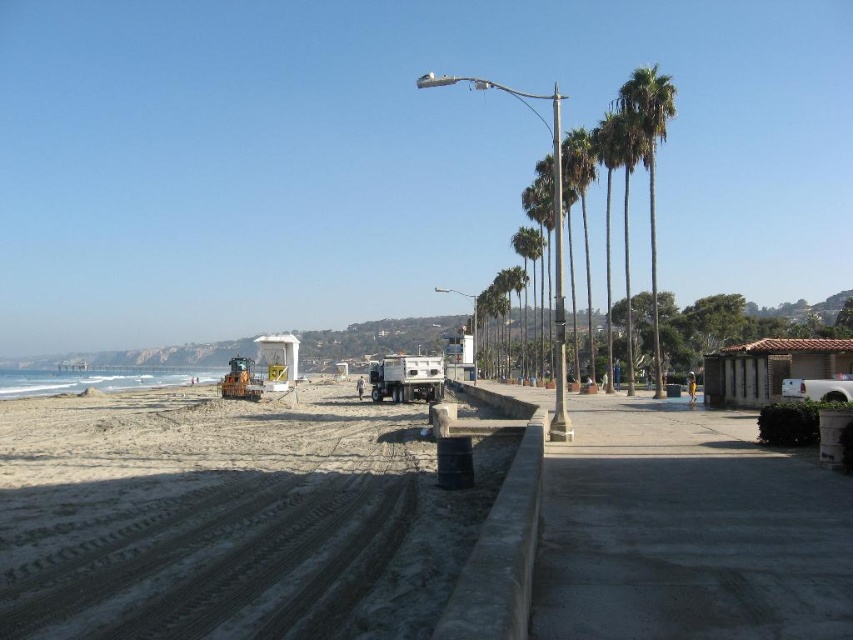
Which is above, white matte camper at center or green leafy palm trees at center?

green leafy palm trees at center

Where is `white matte camper at center`? white matte camper at center is located at coordinates (405, 378).

What do you see at coordinates (405, 378) in the screenshot? This screenshot has width=853, height=640. I see `white matte camper at center` at bounding box center [405, 378].

Image resolution: width=853 pixels, height=640 pixels. Find the location of `white matte camper at center`. white matte camper at center is located at coordinates (405, 378).

Is point (653, 131) positioned behind point (421, 371)?

No.

Who is positioned more to the right, green leafy palm trees at upper right or white matte camper at center?

green leafy palm trees at upper right is more to the right.

Which is behind, point (635, 106) or point (398, 384)?

The point (398, 384) is behind.

Where is `green leafy palm trees at upper right`? The height and width of the screenshot is (640, 853). green leafy palm trees at upper right is located at coordinates click(648, 164).

Does green leafy palm trees at right have a smaller size compared to green leafy palm tree at center-right?

Actually, green leafy palm trees at right might be larger than green leafy palm tree at center-right.

Identify the location of green leafy palm trees at right. This screenshot has height=640, width=853. click(581, 216).

I want to click on green leafy palm trees at right, so click(581, 216).